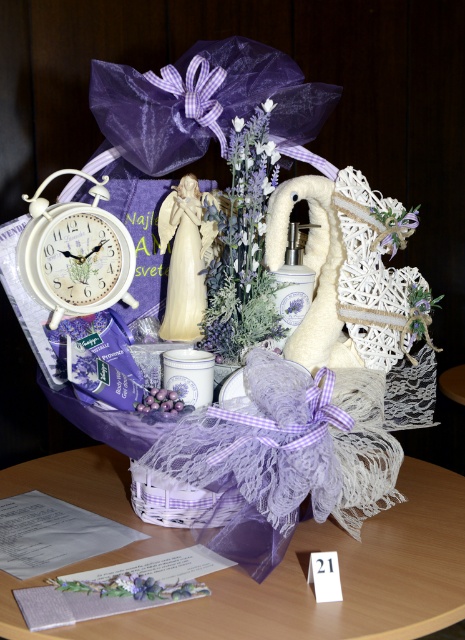
Consider the image. You are arranging a lavender themed gift basket and want to place a white porcelain figurine at center and a lavender fabric flower at center. According to the image, which object is positioned to the right of the other?

The lavender fabric flower at center is positioned to the right of the white porcelain figurine at center.

You are organizing a gift basket and want to ensure the white porcelain figurine at center stays visible. Since the lavender fabric basket at center might shift during transport, which item should you secure first to maintain visibility?

The white porcelain figurine at center is located above the lavender fabric basket at center, so you should secure the white porcelain figurine at center first to ensure it remains visible and doesn not get buried by any shifting items.

You are organizing a gift basket and need to place a new item in the center. The lavender lace basket at center and lavender fabric flower at center are already there. Which object should you move to make space?

The lavender fabric flower at center is behind the lavender lace basket at center, so you should move the lavender fabric flower at center to make space.